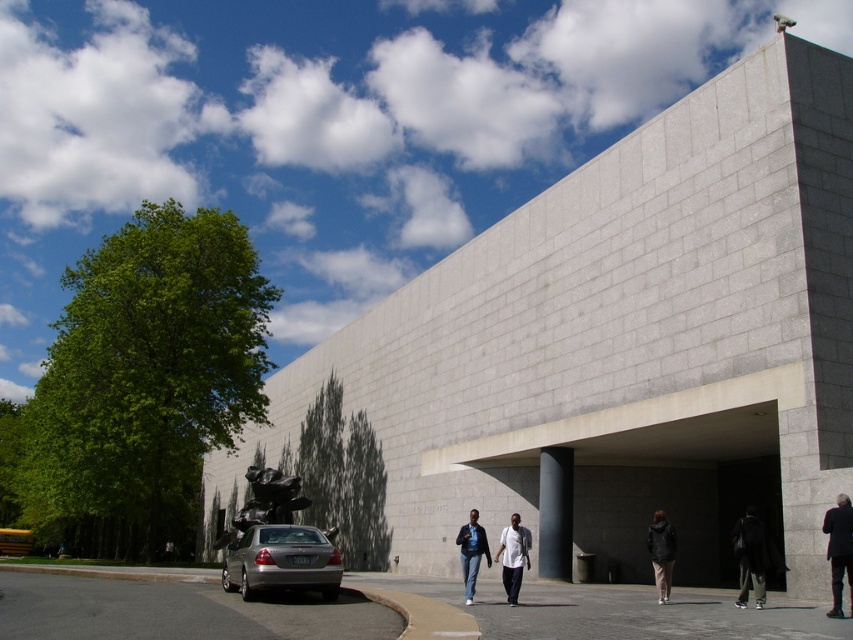
Question: Can you confirm if dark matte jacket at lower right is smaller than white matte shirt at center?

Choices:
 (A) no
 (B) yes

Answer: (B)

Question: Which of these objects is positioned closest to the white matte shirt at center?

Choices:
 (A) dark matte jacket at lower right
 (B) dark gray suit at lower right

Answer: (A)

Question: Which point is farther from the camera taking this photo?

Choices:
 (A) (525, 548)
 (B) (303, 586)
 (C) (846, 552)

Answer: (A)

Question: Considering the relative positions of silver metallic sedan at lower left and dark gray jacket at lower right in the image provided, where is silver metallic sedan at lower left located with respect to dark gray jacket at lower right?

Choices:
 (A) above
 (B) below

Answer: (A)

Question: Is dark matte jacket at lower right wider than dark gray suit at lower right?

Choices:
 (A) no
 (B) yes

Answer: (A)

Question: Estimate the real-world distances between objects in this image. Which object is closer to the dark matte jacket at lower right?

Choices:
 (A) denim pants at center
 (B) white matte shirt at center
 (C) silver metallic sedan at lower left
 (D) dark gray jacket at lower right

Answer: (D)